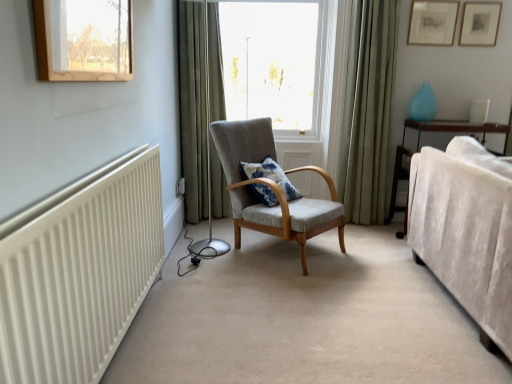
Question: Considering their positions, is matte wooden picture frame at upper right, the 1th picture frame when ordered from right to left, located in front of or behind transparent glass window at center?

Choices:
 (A) behind
 (B) front

Answer: (A)

Question: Is point (482, 13) positioned closer to the camera than point (285, 66)?

Choices:
 (A) farther
 (B) closer

Answer: (B)

Question: Considering the real-world distances, which object is closest to the green fabric curtain at right, which is the 2th curtain in left-to-right order?

Choices:
 (A) velvet beige couch at right
 (B) green fabric curtain at center, placed as the second curtain when sorted from right to left
 (C) matte wooden picture frame at upper right, the 1th picture frame when ordered from right to left
 (D) textured gray armchair at center
 (E) matte gold picture frame at upper right, which is the 2th picture frame from right to left

Answer: (E)

Question: Which is farther from the blue printed cushion at center?

Choices:
 (A) green fabric curtain at right, the first curtain positioned from the right
 (B) textured gray armchair at center
 (C) green fabric curtain at center, marked as the first curtain in a left-to-right arrangement
 (D) matte gold picture frame at upper right, which is the 2th picture frame from right to left
 (E) matte wooden picture frame at upper right, the 2th picture frame viewed from the left

Answer: (E)